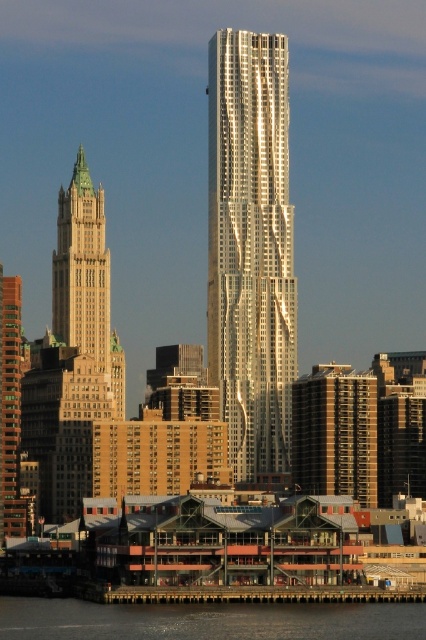
Question: Is shiny metallic skyscraper at center thinner than gold textured building at left?

Choices:
 (A) no
 (B) yes

Answer: (A)

Question: Based on their relative distances, which object is nearer to the transparent water at lower center?

Choices:
 (A) gold textured building at left
 (B) brown brick building at left
 (C) shiny metallic skyscraper at center

Answer: (B)

Question: Does shiny metallic skyscraper at center appear over gold textured building at left?

Choices:
 (A) yes
 (B) no

Answer: (A)

Question: Is shiny metallic skyscraper at center to the left of transparent water at lower center from the viewer's perspective?

Choices:
 (A) no
 (B) yes

Answer: (A)

Question: Among these points, which one is farthest from the camera?

Choices:
 (A) (11, 289)
 (B) (324, 630)

Answer: (A)

Question: Which is nearer to the shiny metallic skyscraper at center?

Choices:
 (A) gold textured building at left
 (B) brown brick building at left

Answer: (A)